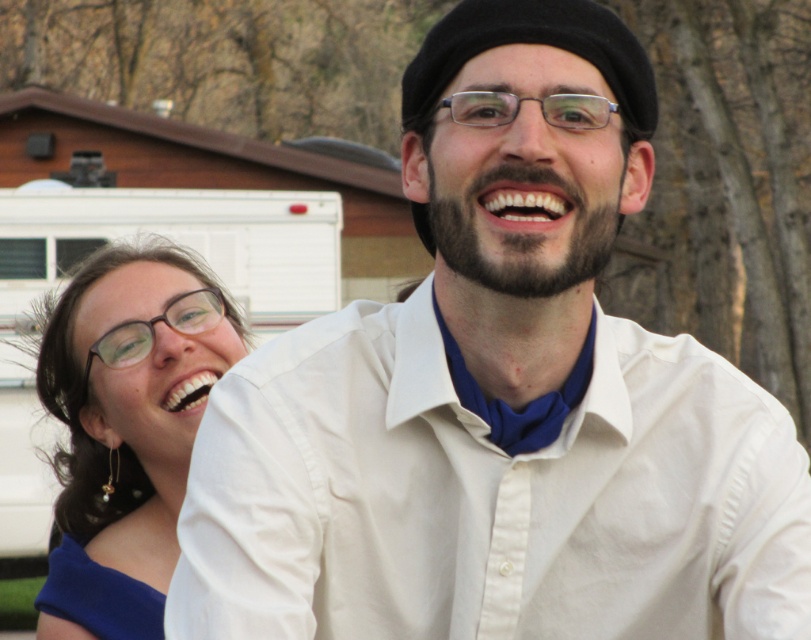
You are standing in front of the two people in the image. Which of the two points, point (89, 358) or point (485, 100), is closer to you?

Point (89, 358) is closer to you because it is further to the viewer than point (485, 100).

You are a fashion designer observing two blue fabric dresses in an image. The first is labeled as the blue fabric dress at left, and the second as the blue fabric dress at lower left. Based on the scene description, which dress has a wider width?

The blue fabric dress at left has a larger width than the blue fabric dress at lower left.

You are a fashion designer observing two blue fabric dresses in an image. The first is labeled as the blue fabric dress at left, and the second as the blue fabric dress at lower left. Based on their positions, which dress appears taller?

The blue fabric dress at left appears taller than the blue fabric dress at lower left according to their positions in the image.